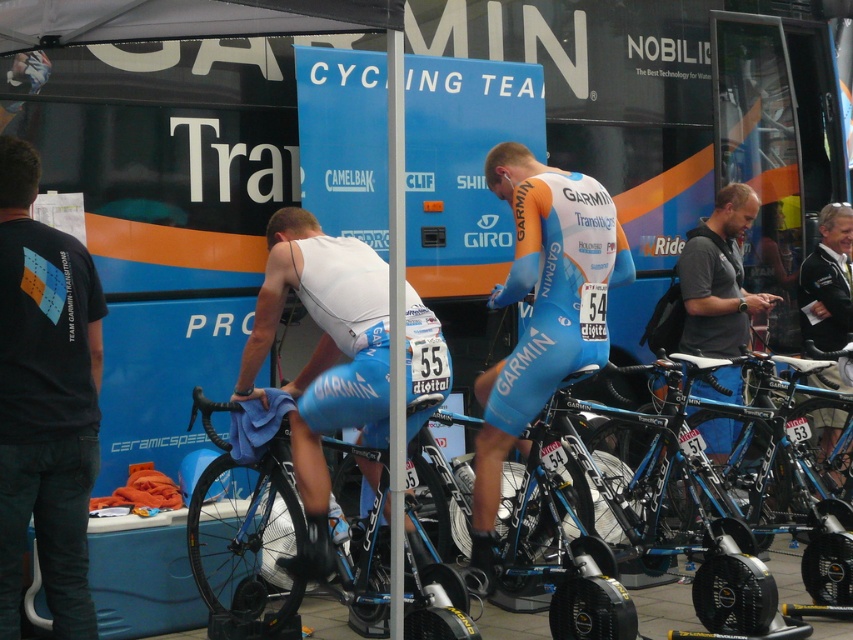
Question: Which is farther from the blue carbon fiber bicycle at center?

Choices:
 (A) matte blue cycling suit at center
 (B) white plastic pole at center
 (C) white matte cycling jersey at center
 (D) blue synthetic suit at center

Answer: (D)

Question: Observing the image, what is the correct spatial positioning of white matte cycling jersey at center in reference to blue synthetic suit at center?

Choices:
 (A) below
 (B) above

Answer: (A)

Question: Which point is farther to the camera?

Choices:
 (A) white matte cycling jersey at center
 (B) black cotton t-shirt at left
 (C) matte blue cycling suit at center
 (D) blue carbon fiber bicycle at center

Answer: (C)

Question: Which point is farther to the camera?

Choices:
 (A) (697, 262)
 (B) (392, 65)

Answer: (A)

Question: Can you confirm if white plastic pole at center is positioned above blue synthetic suit at center?

Choices:
 (A) no
 (B) yes

Answer: (A)

Question: Is white plastic pole at center to the right of blue synthetic suit at center from the viewer's perspective?

Choices:
 (A) yes
 (B) no

Answer: (B)